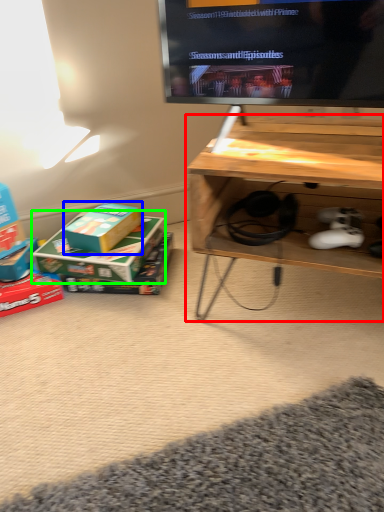
Question: Which is nearer to the table (highlighted by a red box)? box (highlighted by a blue box) or box (highlighted by a green box).

Choices:
 (A) box
 (B) box

Answer: (B)